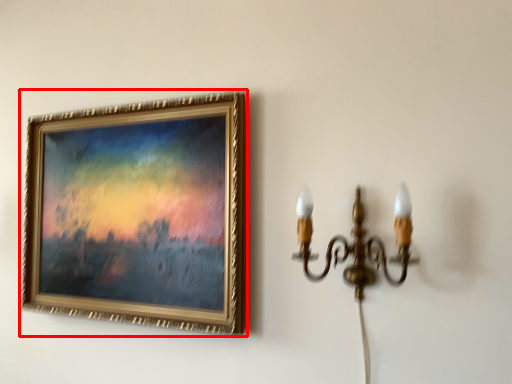
Question: From the image's perspective, what is the correct spatial relationship of picture frame (annotated by the red box) in relation to lamp?

Choices:
 (A) above
 (B) below

Answer: (A)